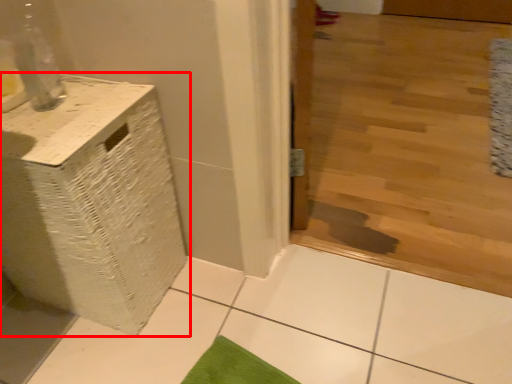
Question: From the image's perspective, where is furniture (annotated by the red box) located relative to mat?

Choices:
 (A) below
 (B) above

Answer: (A)